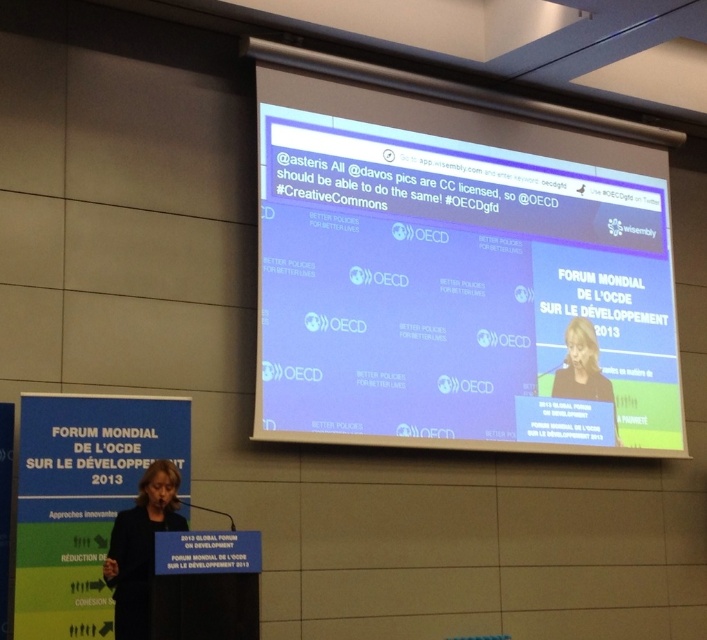
Question: Which of these objects is positioned closest to the dark blue fabric at center?

Choices:
 (A) white matte projection screen at upper center
 (B) dark gray suit at center

Answer: (A)

Question: Observing the image, what is the correct spatial positioning of white matte projection screen at upper center in reference to dark gray suit at center?

Choices:
 (A) left
 (B) right

Answer: (A)

Question: Is dark blue fabric at center above dark gray suit at center?

Choices:
 (A) yes
 (B) no

Answer: (B)

Question: Which point appears closest to the camera in this image?

Choices:
 (A) (175, 483)
 (B) (431, 202)

Answer: (A)

Question: Is white matte projection screen at upper center wider than dark gray suit at center?

Choices:
 (A) no
 (B) yes

Answer: (B)

Question: Which object is farther from the camera taking this photo?

Choices:
 (A) dark blue fabric at center
 (B) white matte projection screen at upper center

Answer: (B)